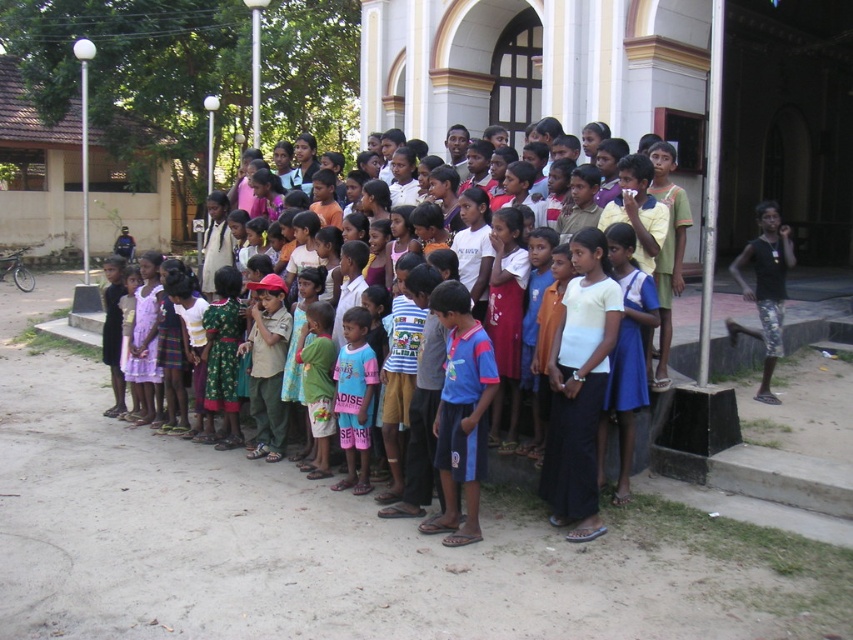
Question: Is multicolored clothing at center positioned in front of camouflage-patterned shorts at right?

Choices:
 (A) no
 (B) yes

Answer: (B)

Question: Does multicolored clothing at center come in front of camouflage-patterned shorts at right?

Choices:
 (A) no
 (B) yes

Answer: (B)

Question: Does multicolored clothing at center come in front of camouflage-patterned shorts at right?

Choices:
 (A) no
 (B) yes

Answer: (B)

Question: Which point is farther from the camera taking this photo?

Choices:
 (A) (459, 301)
 (B) (786, 228)

Answer: (B)